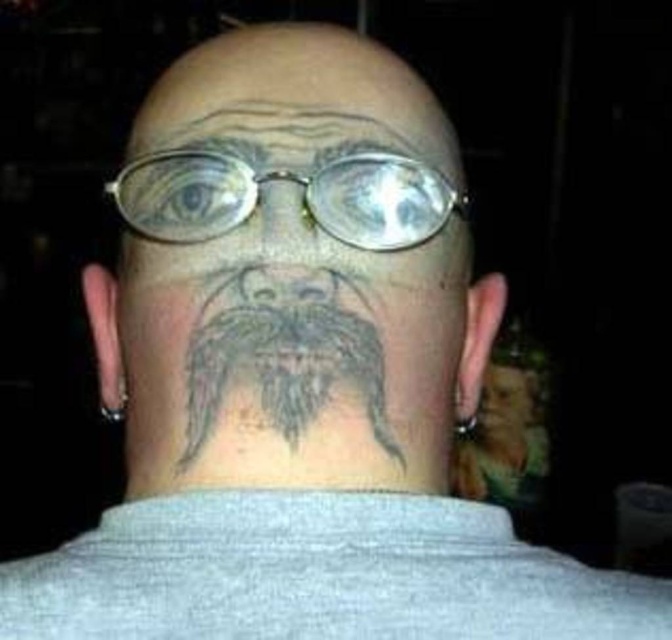
You are a tattoo artist assessing a client who wants to add a new tattoo on their face. The client already has a gray tattooed forehead at upper center and a gray tattooed beard at center. Based on their current tattoos, which tattoo is taller?

The gray tattooed forehead at upper center is taller than the gray tattooed beard at center.